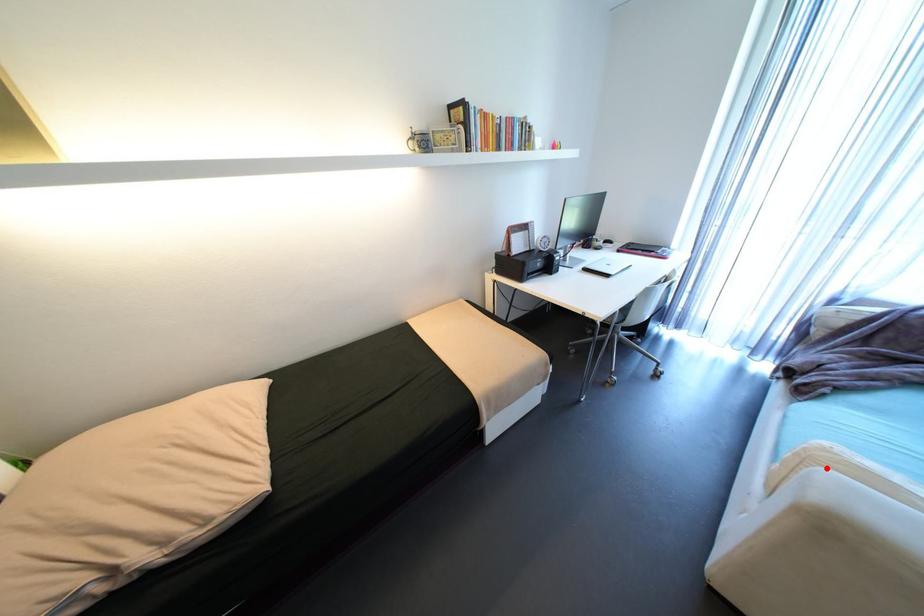
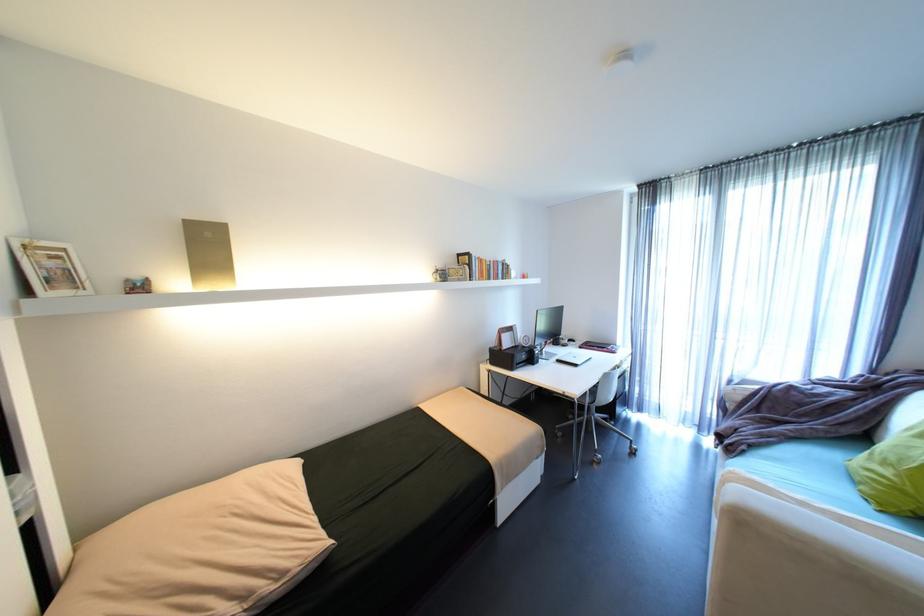
The point at the highlighted location is marked in the first image. Where is the corresponding point in the second image?

(737, 485)